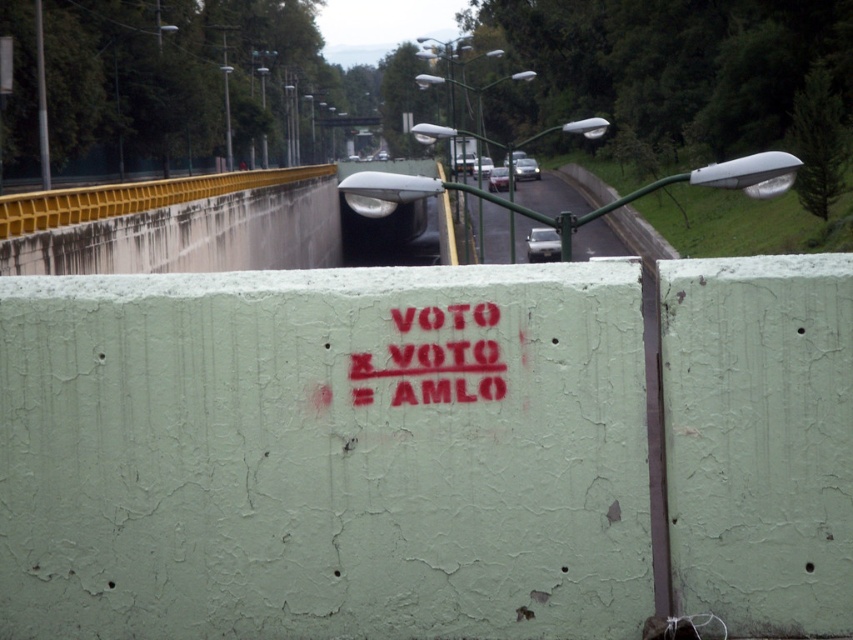
Question: In this image, where is green concrete wall at center located relative to gray asphalt road at center?

Choices:
 (A) left
 (B) right

Answer: (A)

Question: Which object is farther from the camera taking this photo?

Choices:
 (A) red paint graffiti at center
 (B) green concrete wall at center
 (C) gray asphalt road at center

Answer: (C)

Question: Is green concrete wall at center closer to the viewer compared to gray asphalt road at center?

Choices:
 (A) no
 (B) yes

Answer: (B)

Question: Observing the image, what is the correct spatial positioning of green concrete wall at center in reference to gray asphalt road at center?

Choices:
 (A) right
 (B) left

Answer: (B)

Question: Among these points, which one is farthest from the camera?

Choices:
 (A) (341, 516)
 (B) (457, 362)
 (C) (490, 209)

Answer: (C)

Question: Which of these objects is positioned closest to the gray asphalt road at center?

Choices:
 (A) red paint graffiti at center
 (B) green concrete wall at center

Answer: (A)